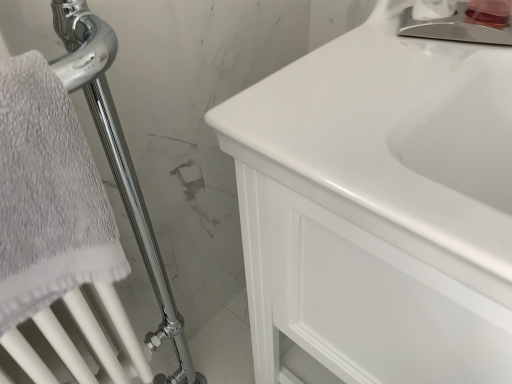
Question: Considering the relative sizes of white glossy soap dispenser at upper right, which ranks as the second toiletry in right-to-left order, and pink plastic container at upper right, the second toiletry when ordered from left to right, in the image provided, is white glossy soap dispenser at upper right, which ranks as the second toiletry in right-to-left order, thinner than pink plastic container at upper right, the second toiletry when ordered from left to right,?

Choices:
 (A) yes
 (B) no

Answer: (A)

Question: Is the position of white glossy soap dispenser at upper right, which ranks as the first toiletry in left-to-right order, more distant than that of pink plastic container at upper right, the second toiletry when ordered from left to right?

Choices:
 (A) no
 (B) yes

Answer: (B)

Question: Is white glossy soap dispenser at upper right, which ranks as the second toiletry in right-to-left order, completely or partially outside of pink plastic container at upper right, the second toiletry when ordered from left to right?

Choices:
 (A) yes
 (B) no

Answer: (A)

Question: Is white glossy soap dispenser at upper right, which ranks as the first toiletry in left-to-right order, shorter than pink plastic container at upper right, the second toiletry when ordered from left to right?

Choices:
 (A) no
 (B) yes

Answer: (A)

Question: Is white glossy soap dispenser at upper right, which ranks as the second toiletry in right-to-left order, in front of pink plastic container at upper right, the second toiletry when ordered from left to right?

Choices:
 (A) no
 (B) yes

Answer: (A)

Question: From the image's perspective, is white glossy soap dispenser at upper right, which ranks as the second toiletry in right-to-left order, above or below white glossy cabinet at center?

Choices:
 (A) above
 (B) below

Answer: (A)

Question: Considering the positions of white glossy soap dispenser at upper right, which ranks as the second toiletry in right-to-left order, and white glossy cabinet at center in the image, is white glossy soap dispenser at upper right, which ranks as the second toiletry in right-to-left order, wider or thinner than white glossy cabinet at center?

Choices:
 (A) thin
 (B) wide

Answer: (A)

Question: Is white glossy soap dispenser at upper right, which ranks as the second toiletry in right-to-left order, in front of or behind white glossy cabinet at center in the image?

Choices:
 (A) front
 (B) behind

Answer: (B)

Question: Considering the relative positions of white glossy soap dispenser at upper right, which ranks as the second toiletry in right-to-left order, and white glossy cabinet at center in the image provided, is white glossy soap dispenser at upper right, which ranks as the second toiletry in right-to-left order, to the left or to the right of white glossy cabinet at center?

Choices:
 (A) left
 (B) right

Answer: (B)

Question: Looking at their shapes, would you say polished chrome faucet at upper right is wider or thinner than white glossy cabinet at center?

Choices:
 (A) thin
 (B) wide

Answer: (A)

Question: Looking at the image, does polished chrome faucet at upper right seem bigger or smaller compared to white glossy cabinet at center?

Choices:
 (A) big
 (B) small

Answer: (B)

Question: Which is correct: polished chrome faucet at upper right is inside white glossy cabinet at center, or outside of it?

Choices:
 (A) inside
 (B) outside

Answer: (A)

Question: From the image's perspective, is polished chrome faucet at upper right above or below white glossy cabinet at center?

Choices:
 (A) above
 (B) below

Answer: (A)

Question: From the image's perspective, is pink plastic container at upper right, the second toiletry when ordered from left to right, above or below white glossy cabinet at center?

Choices:
 (A) above
 (B) below

Answer: (A)

Question: In terms of height, does pink plastic container at upper right, which is counted as the 1th toiletry, starting from the right, look taller or shorter compared to white glossy cabinet at center?

Choices:
 (A) tall
 (B) short

Answer: (B)